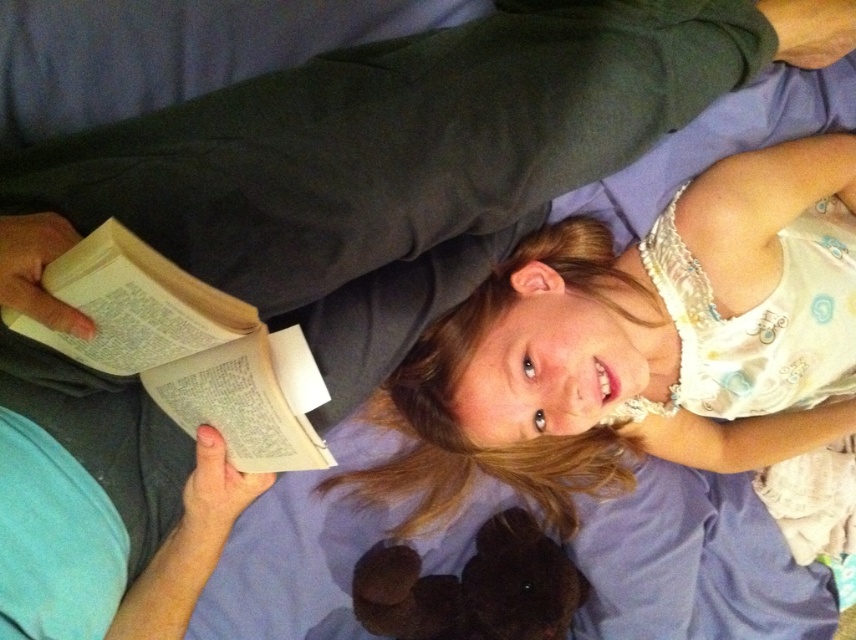
You are a photographer trying to capture a portrait of the smooth white shirt at center and the dark brown plush at lower center. Which object should you focus on first if you want to ensure both are in focus, considering their heights?

The smooth white shirt at center has a greater height compared to dark brown plush at lower center. To ensure both are in focus, you should focus on the smooth white shirt at center first because it is taller and requires adjusting the depth of field to accommodate the height difference.

You are a delivery robot with a package that is 14 inches wide. You need to place it between the smooth white shirt at center and the white paper book at left. Is there enough space?

The distance between the smooth white shirt at center and the white paper book at left is 13.96 inches, which is slightly less than the package width of 14 inches. Therefore, there is not enough space to place the package between them.

You are standing at the foot of the bed and want to place a small gift on the bed. You have two points to choose from. The first point is point (450, 378) and the second is point (80, 346). Which point is closer to you?

Point (80, 346) is closer to you because it is in front of point (450, 378).